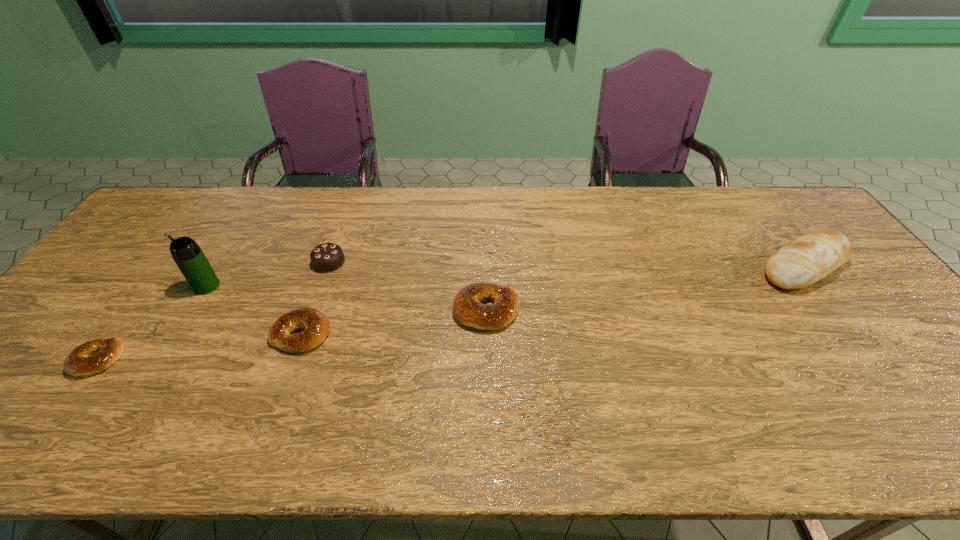
Image resolution: width=960 pixels, height=540 pixels. I want to click on the shortest bagel, so click(95, 356).

What are the coordinates of `the leftmost bagel` in the screenshot? It's located at (95, 356).

Where is `the second tallest bagel`? The width and height of the screenshot is (960, 540). the second tallest bagel is located at coordinates (316, 326).

Find the location of a particular element. Image resolution: width=960 pixels, height=540 pixels. the second bagel from right to left is located at coordinates (316, 326).

Find the location of a particular element. The image size is (960, 540). the fifth object from left to right is located at coordinates (468, 309).

At what (x,y) coordinates should I click in order to perform the action: click on the tallest bagel. Please return your answer as a coordinate pair (x, y). The image size is (960, 540). Looking at the image, I should click on (468, 309).

Locate an element on the screen. This screenshot has width=960, height=540. the rightmost object is located at coordinates (809, 258).

Image resolution: width=960 pixels, height=540 pixels. What are the coordinates of `the fifth shortest object` in the screenshot? It's located at (809, 258).

I want to click on the fourth shortest object, so click(x=327, y=257).

Where is `thermos bottle`? The height and width of the screenshot is (540, 960). thermos bottle is located at coordinates (190, 259).